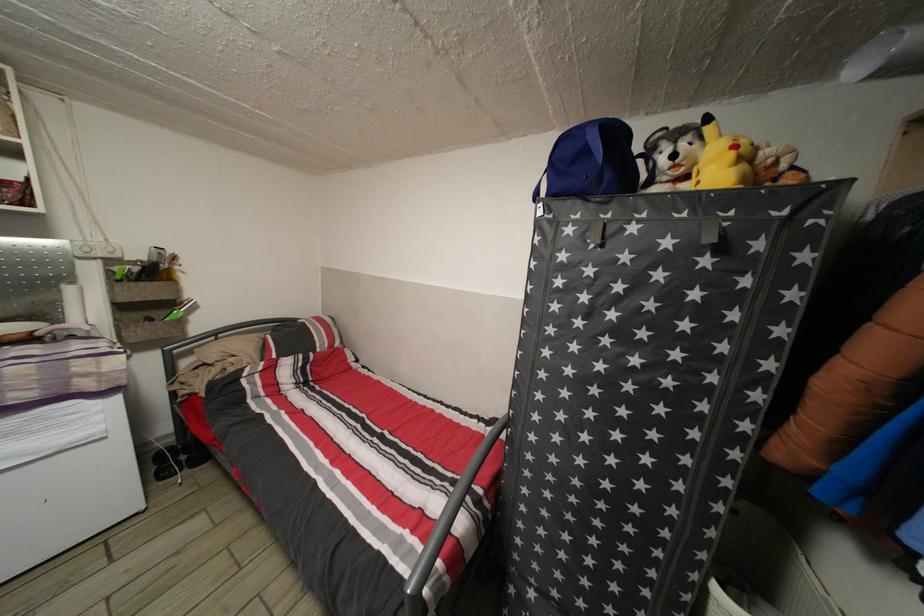
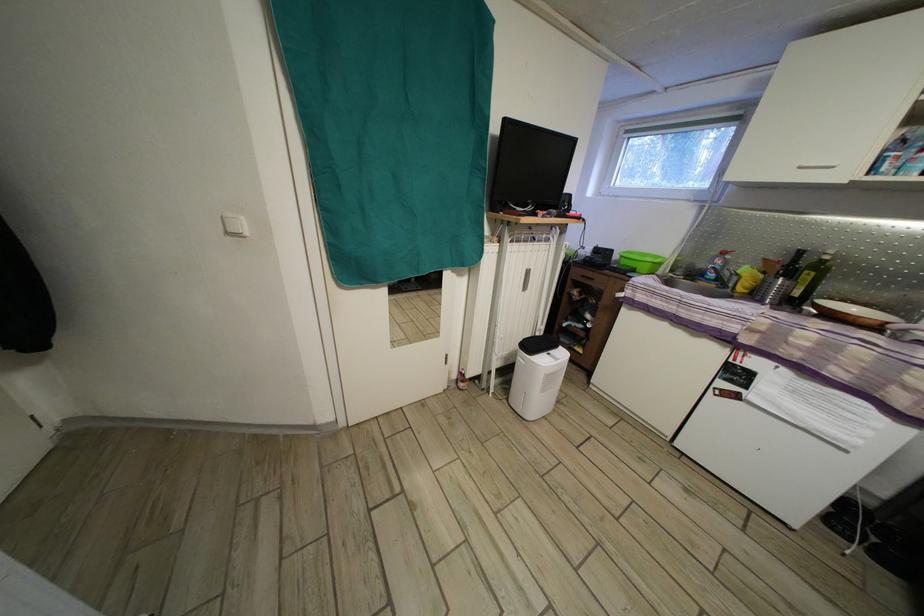
The first image is from the beginning of the video and the second image is from the end. How did the camera likely rotate when shooting the video?

The camera rotated toward left-down.